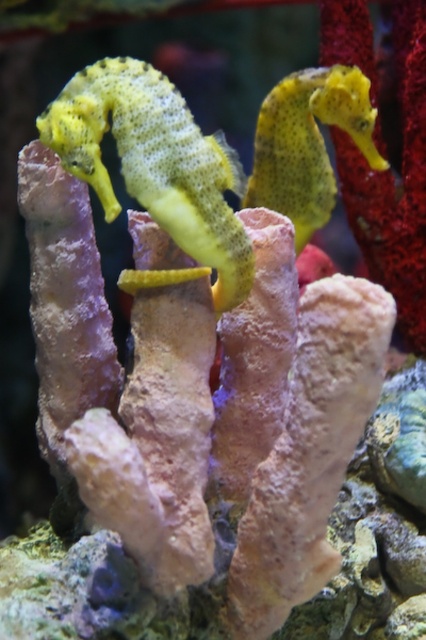
Question: Is yellow matte seahorse at center smaller than yellow textured seahorse at upper right?

Choices:
 (A) no
 (B) yes

Answer: (A)

Question: Is yellow matte seahorse at center positioned before yellow textured seahorse at upper right?

Choices:
 (A) no
 (B) yes

Answer: (B)

Question: Which object appears closest to the camera in this image?

Choices:
 (A) yellow matte seahorse at center
 (B) yellow textured seahorse at upper right

Answer: (A)

Question: Among these objects, which one is farthest from the camera?

Choices:
 (A) yellow textured seahorse at upper right
 (B) yellow matte seahorse at center

Answer: (A)

Question: Where is yellow matte seahorse at center located in relation to yellow textured seahorse at upper right in the image?

Choices:
 (A) left
 (B) right

Answer: (A)